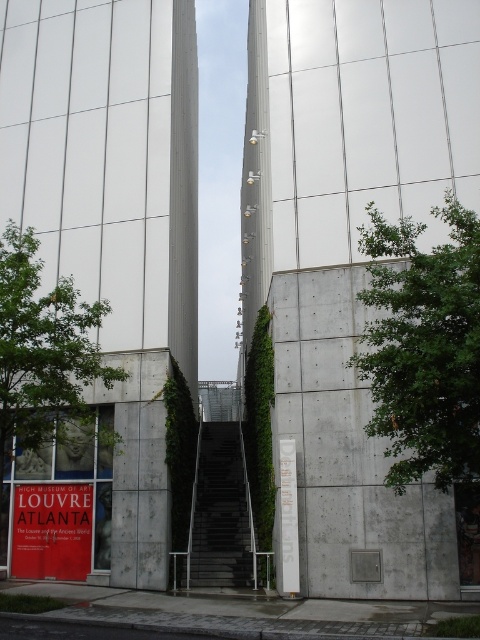
Question: Does white concrete tower at center lie in front of gray concrete wall at center?

Choices:
 (A) yes
 (B) no

Answer: (B)

Question: Among these objects, which one is farthest from the camera?

Choices:
 (A) gray concrete wall at center
 (B) smooth concrete tower at center

Answer: (B)

Question: Is gray concrete wall at center positioned in front of red paper sign at lower left?

Choices:
 (A) yes
 (B) no

Answer: (A)

Question: Can you confirm if white concrete tower at center is thinner than black metal stairs at center?

Choices:
 (A) yes
 (B) no

Answer: (B)

Question: Which of the following is the farthest from the observer?

Choices:
 (A) white concrete tower at center
 (B) gray concrete wall at center
 (C) red paper sign at lower left

Answer: (C)

Question: Which is farther from the smooth concrete tower at center?

Choices:
 (A) red paper sign at lower left
 (B) gray concrete wall at center
 (C) black metal stairs at center

Answer: (A)